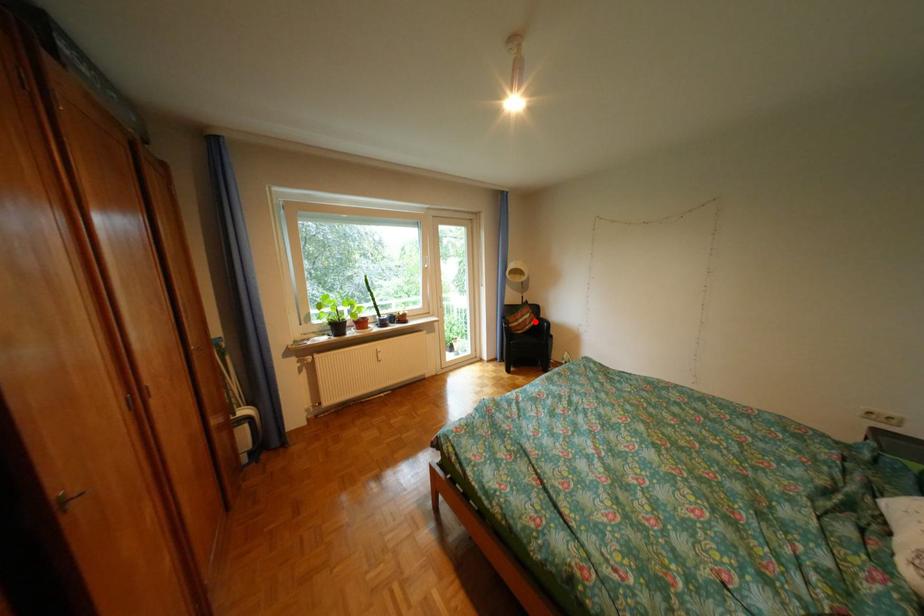
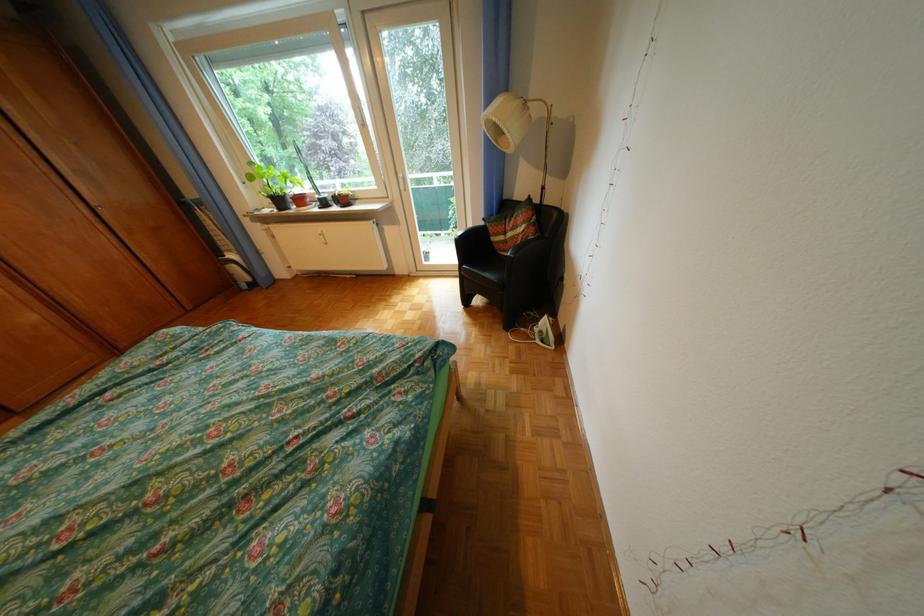
Locate, in the second image, the point that corresponds to the highlighted location in the first image.

(524, 236)